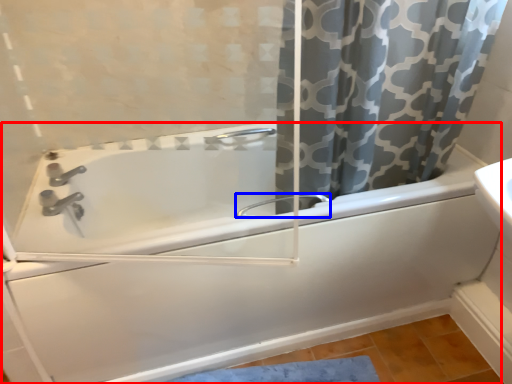
Question: Which object appears farthest to the camera in this image, bathtub (highlighted by a red box) or faucet (highlighted by a blue box)?

Choices:
 (A) bathtub
 (B) faucet

Answer: (B)